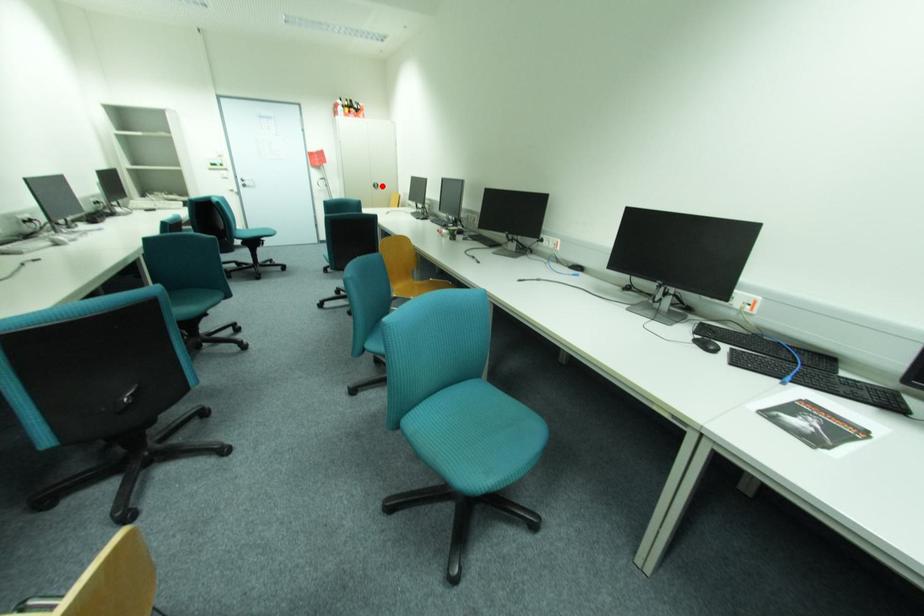
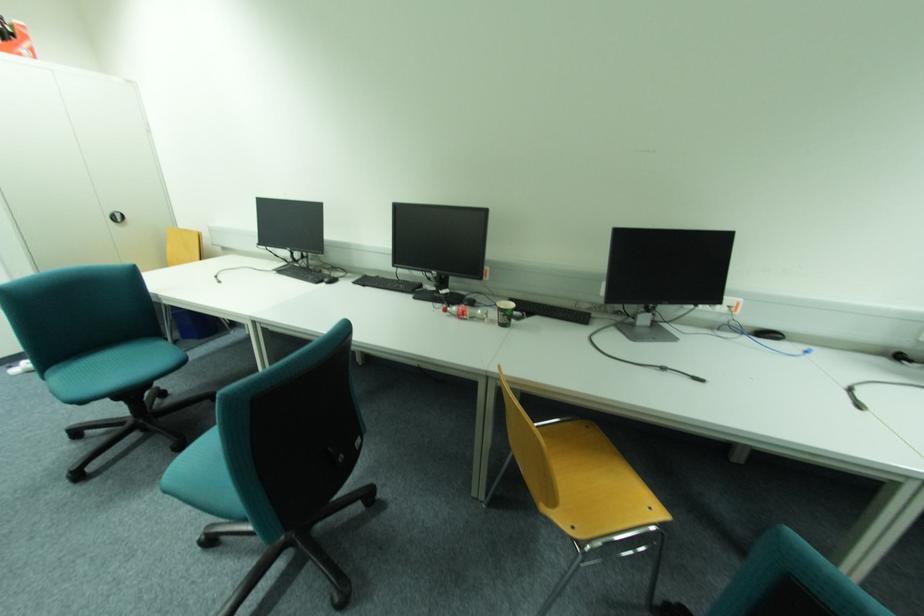
Locate, in the second image, the point that corresponds to the highlighted location in the first image.

(126, 219)